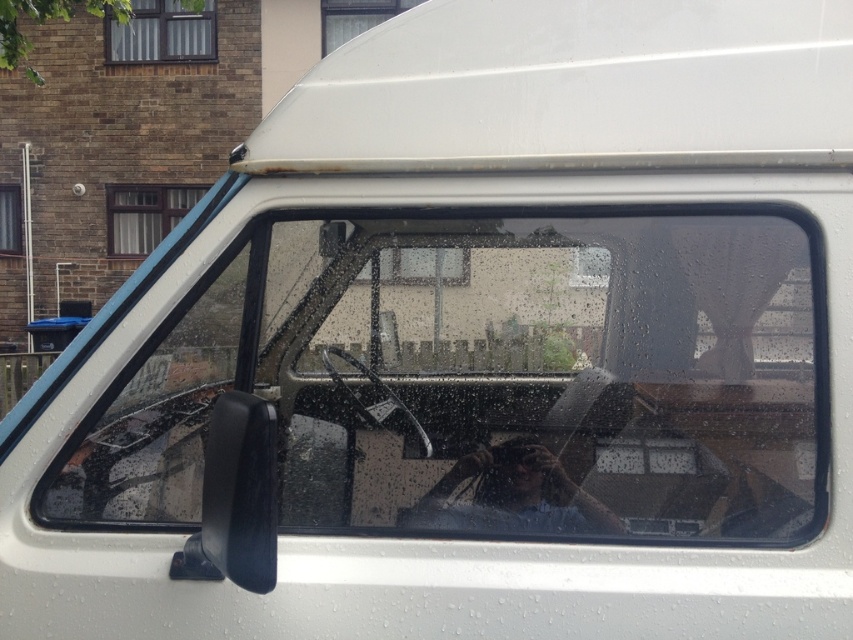
Question: Which point is farther to the camera?

Choices:
 (A) transparent glass window at upper center
 (B) clear glass window at upper left
 (C) matte glass window at upper left
 (D) transparent glass windshield at center

Answer: (B)

Question: Which point is closer to the camera?

Choices:
 (A) (119, 49)
 (B) (15, 234)
 (C) (602, 522)

Answer: (C)

Question: Can you confirm if transparent glass windshield at center is thinner than white glass window at upper center?

Choices:
 (A) yes
 (B) no

Answer: (B)

Question: Which point is closer to the camera taking this photo?

Choices:
 (A) (157, 208)
 (B) (177, 486)
 (C) (491, 490)
 (D) (131, 19)

Answer: (C)

Question: Does transparent glass windshield at center have a smaller size compared to clear glass window at upper left?

Choices:
 (A) yes
 (B) no

Answer: (B)

Question: Considering the relative positions of matte glass window at upper left and clear glass window at upper left in the image provided, where is matte glass window at upper left located with respect to clear glass window at upper left?

Choices:
 (A) below
 (B) above

Answer: (B)